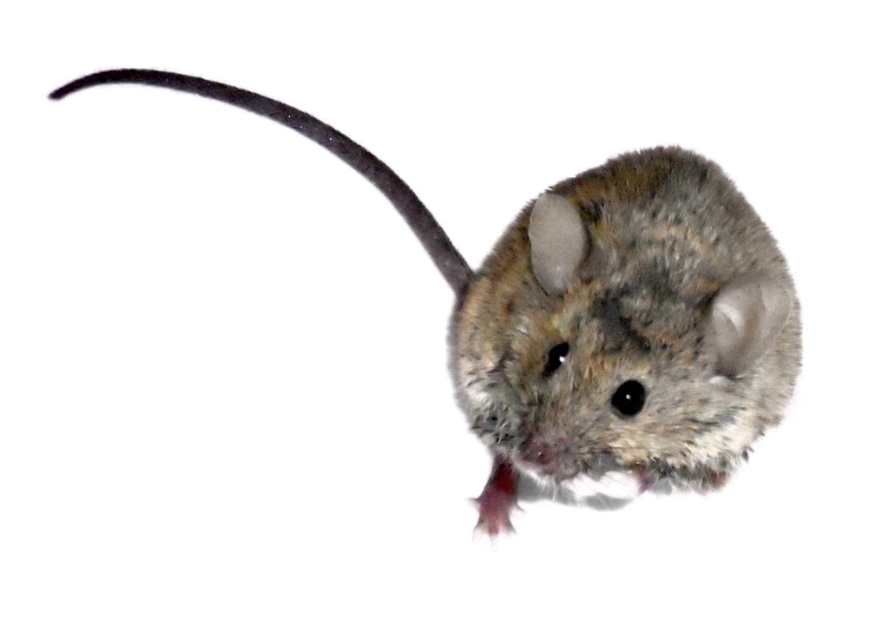
Is the position of fuzzy gray mouse at center less distant than that of silvery metallic tail at upper left?

Yes, fuzzy gray mouse at center is in front of silvery metallic tail at upper left.

Which is behind, point (535, 227) or point (321, 125)?

The point (321, 125) is behind.

Who is more forward, (697, 284) or (303, 113)?

Positioned in front is point (697, 284).

The width and height of the screenshot is (889, 640). Identify the location of fuzzy gray mouse at center. (594, 316).